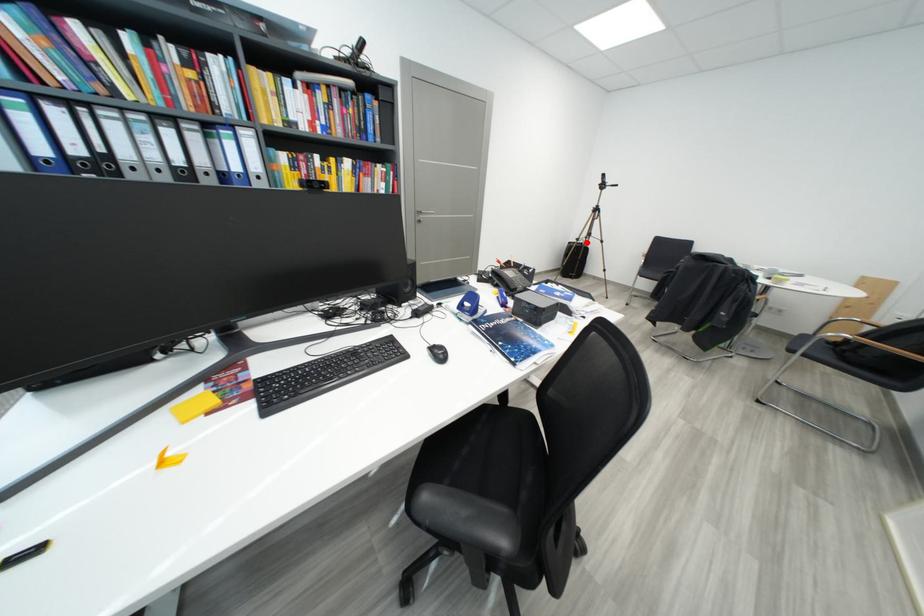
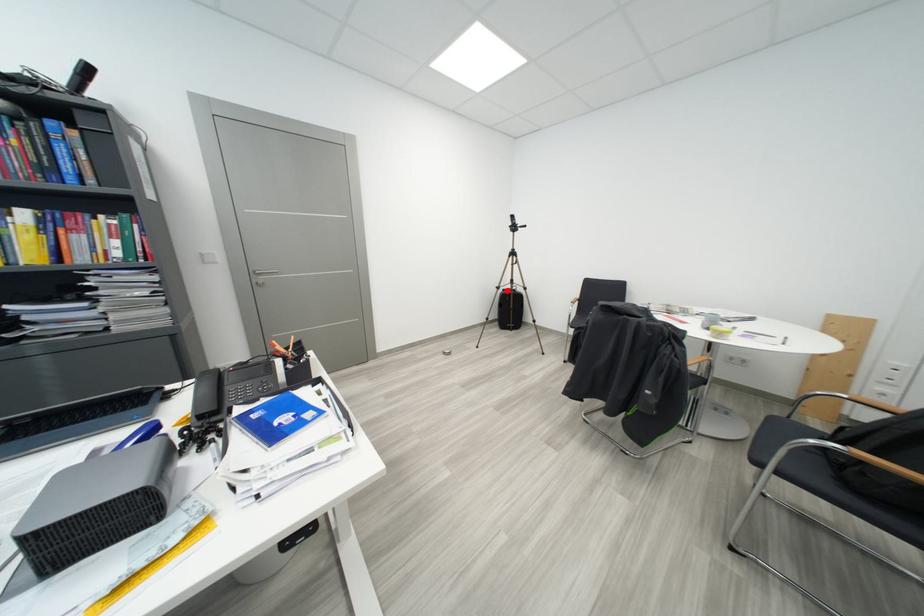
I am providing you with two images of the same scene from different viewpoints. A red point is marked on the first image and another point is marked on the second image. Do the highlighted points in image1 and image2 indicate the same real-world spot?

Yes